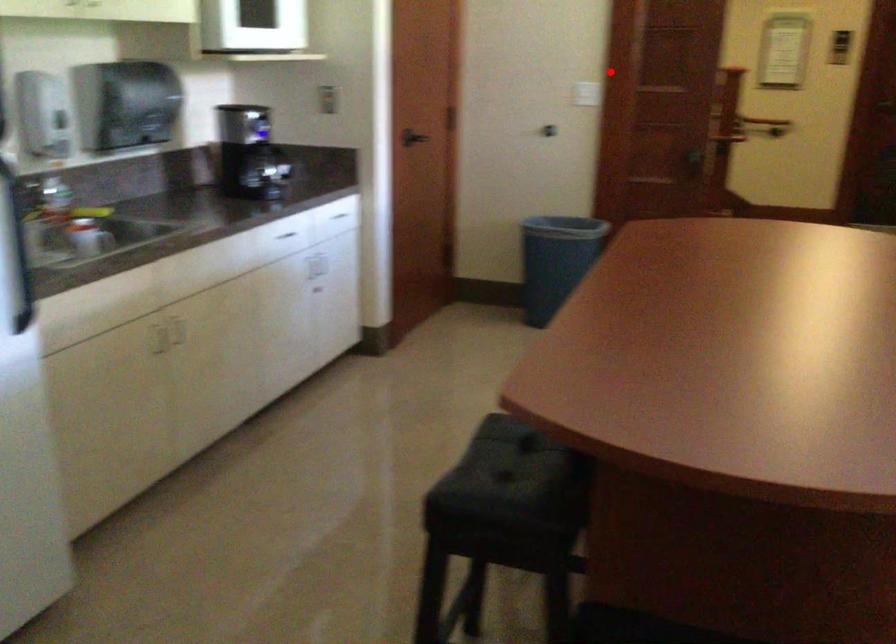
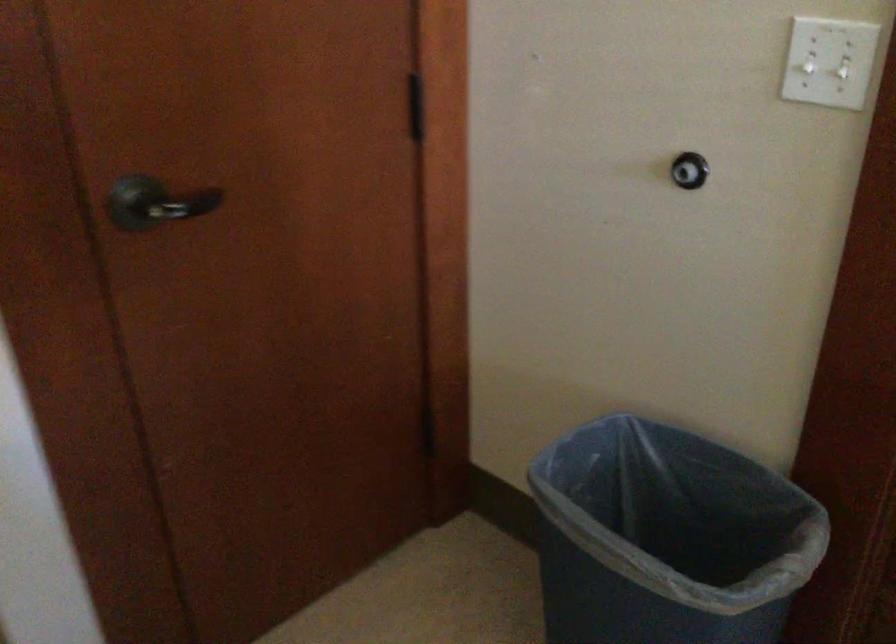
Locate, in the second image, the point that corresponds to the highlighted location in the first image.

(842, 67)